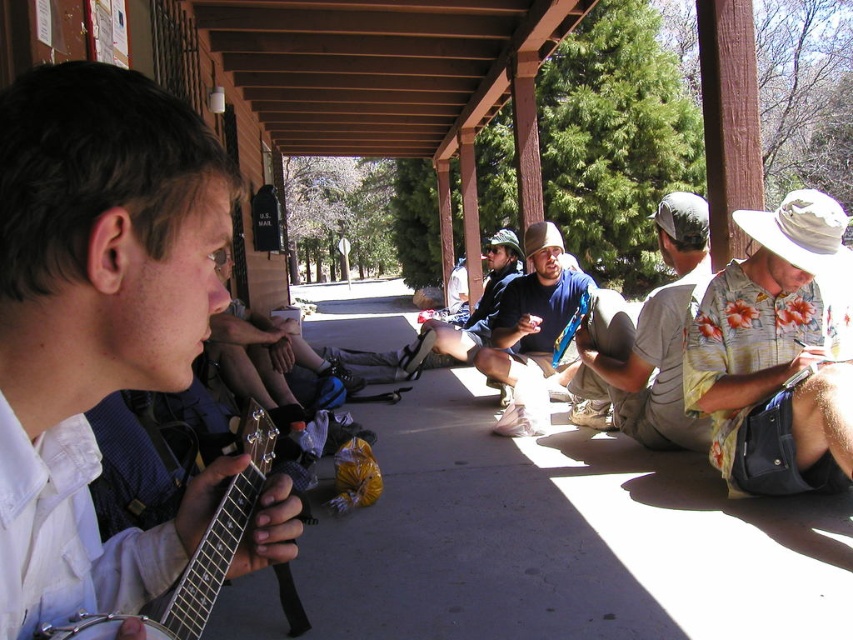
You are a photographer trying to capture a candid shot of the blue denim jeans at center and the matte black guitar at left. Since you want to include both in the frame, which object should you position closer to the edge of the photo?

You should position the matte black guitar at left closer to the edge of the photo because it is already to the left of the blue denim jeans at center, meaning it is further away from the center of the frame.

You are a photographer trying to capture a candid shot of the blue denim jeans at center and the metallic silver banjo at left. Based on their positions, which object is closer to the right edge of the image?

The blue denim jeans at center is closer to the right edge of the image because it is positioned to the right of the metallic silver banjo at left.

You are a photographer trying to capture a candid shot of the floral cotton shirt at right and the matte black guitar at left. Since you want to include both in the frame, which direction should you position your camera relative to the subjects?

The matte black guitar at left is positioned on the left side of the floral cotton shirt at right. To capture both in the frame, position your camera to the left side of the subjects so that the guitar and shirt are both visible.